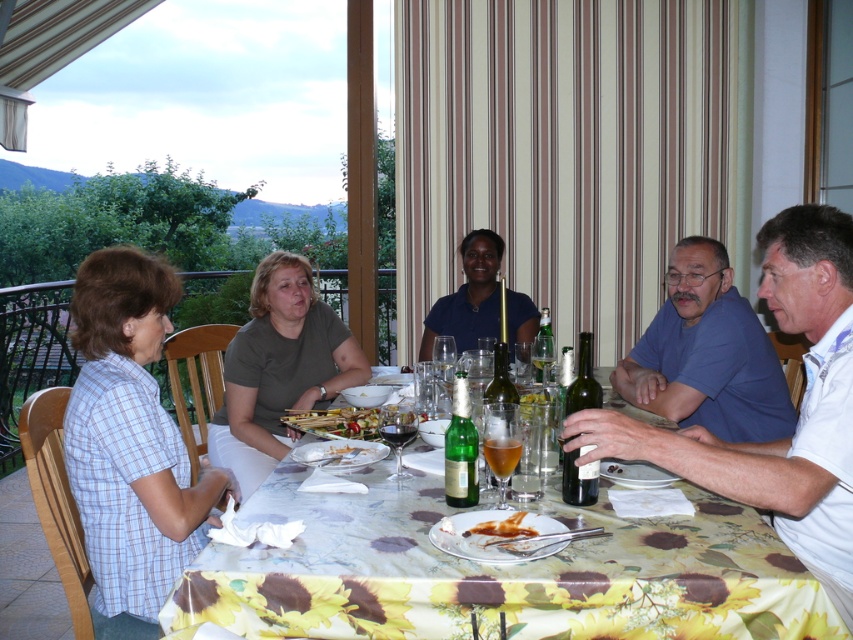
You are at a dinner party and want to grab a drink. You see a green glass bottle at center and a translucent glass beer at center. Which one is taller?

The green glass bottle at center is taller than the translucent glass beer at center.

You are a waiter at an outdoor dining area. You see the translucent glass beer at center and the translucent glass wine at table center. Which glass is closer to the edge of the table?

The translucent glass beer at center is closer to the edge of the table because it is positioned below the translucent glass wine at table center, which places it further outward.